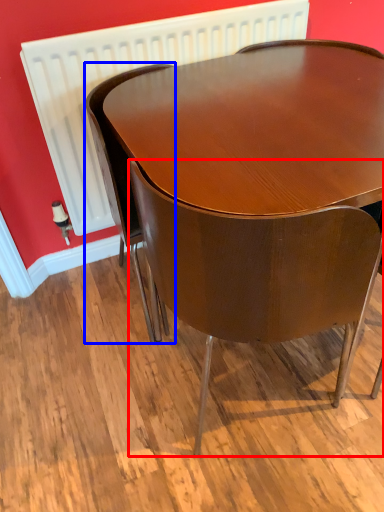
Question: Which object is closer to the camera taking this photo, chair (highlighted by a red box) or chair (highlighted by a blue box)?

Choices:
 (A) chair
 (B) chair

Answer: (A)